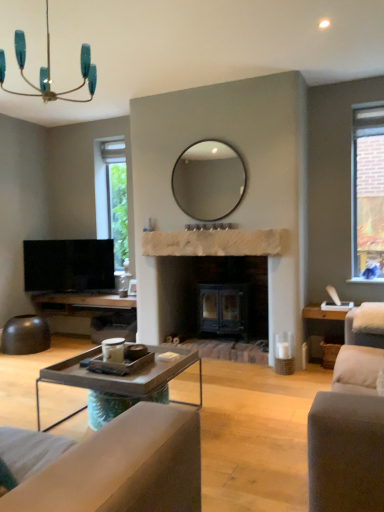
The height and width of the screenshot is (512, 384). Describe the element at coordinates (208, 180) in the screenshot. I see `matte glass mirror at center` at that location.

Image resolution: width=384 pixels, height=512 pixels. I want to click on matte glass mirror at center, so click(x=208, y=180).

From a real-world perspective, which object rests below the other?

In real-world perspective, flat screen tv at left is lower.

From the picture: Is flat screen tv at left aimed at teal glass chandelier at upper left?

No, flat screen tv at left does not turn towards teal glass chandelier at upper left.

Can you tell me how much flat screen tv at left and teal glass chandelier at upper left differ in facing direction?

There is a 21.1-degree angle between the facing directions of flat screen tv at left and teal glass chandelier at upper left.

Considering the sizes of objects matte glass mirror at center and white fabric swivel chair at right in the image provided, who is taller, matte glass mirror at center or white fabric swivel chair at right?

Standing taller between the two is matte glass mirror at center.

Based on the photo, which point is more distant from viewer, [175,174] or [370,341]?

The point [175,174] is more distant.

From a real-world perspective, who is located higher, matte glass mirror at center or white fabric swivel chair at right?

From a 3D spatial view, matte glass mirror at center is above.

Is matte glass mirror at center bigger than flat screen tv at left?

Incorrect, matte glass mirror at center is not larger than flat screen tv at left.

What's the angular difference between matte glass mirror at center and flat screen tv at left's facing directions?

The facing directions of matte glass mirror at center and flat screen tv at left are 23.7 degrees apart.

Which object is thinner, matte glass mirror at center or flat screen tv at left?

matte glass mirror at center.

Image resolution: width=384 pixels, height=512 pixels. What are the coordinates of `mirror above the flat screen tv at left (from a real-world perspective)` in the screenshot? It's located at (208, 180).

Between metallic gray coffee table at lower center and teal glass chandelier at upper left, which one has larger size?

metallic gray coffee table at lower center.

From a real-world perspective, relative to teal glass chandelier at upper left, is metallic gray coffee table at lower center vertically above or below?

In terms of real-world spatial position, metallic gray coffee table at lower center is below teal glass chandelier at upper left.

In the image, is metallic gray coffee table at lower center positioned in front of or behind teal glass chandelier at upper left?

metallic gray coffee table at lower center is behind teal glass chandelier at upper left.

From the image's perspective, is white fabric swivel chair at right located beneath matte glass mirror at center?

Correct, white fabric swivel chair at right appears lower than matte glass mirror at center in the image.

From the picture: Which of these two, white fabric swivel chair at right or matte glass mirror at center, stands taller?

Standing taller between the two is matte glass mirror at center.

Based on their sizes in the image, would you say white fabric swivel chair at right is bigger or smaller than matte glass mirror at center?

In the image, white fabric swivel chair at right appears to be smaller than matte glass mirror at center.

Between metallic gray coffee table at lower center and white fabric swivel chair at right, which one has larger size?

Bigger between the two is metallic gray coffee table at lower center.

In the image, is metallic gray coffee table at lower center on the left side or the right side of white fabric swivel chair at right?

metallic gray coffee table at lower center is to the left of white fabric swivel chair at right.

Locate an element on the screen. The image size is (384, 512). mantle above the flat screen tv at left (from the image's perspective) is located at coordinates (216, 242).

Between flat screen tv at left and natural stone fireplace at center, which one has smaller size?

With smaller size is natural stone fireplace at center.

Between flat screen tv at left and natural stone fireplace at center, which one is positioned behind?

flat screen tv at left is further from the camera.

Is flat screen tv at left positioned with its back to natural stone fireplace at center?

No, flat screen tv at left is not facing away from natural stone fireplace at center.

Identify the location of light fixture in front of the flat screen tv at left. Image resolution: width=384 pixels, height=512 pixels. (49, 70).

The height and width of the screenshot is (512, 384). What are the coordinates of `mirror behind the white fabric swivel chair at right` in the screenshot? It's located at (208, 180).

When comparing their distances from metallic gray coffee table at lower center, does white fabric swivel chair at right or natural stone fireplace at center seem closer?

Based on the image, white fabric swivel chair at right appears to be nearer to metallic gray coffee table at lower center.

Considering their positions, is matte glass mirror at center positioned closer to white fabric swivel chair at right than teal glass chandelier at upper left?

matte glass mirror at center is closer to white fabric swivel chair at right.

From the image, which object appears to be farther from natural stone fireplace at center, white fabric swivel chair at right or metallic gray coffee table at lower center?

Based on the image, metallic gray coffee table at lower center appears to be further to natural stone fireplace at center.

Based on their spatial positions, is white fabric swivel chair at right or teal glass chandelier at upper left closer to natural stone fireplace at center?

The object closer to natural stone fireplace at center is white fabric swivel chair at right.

Based on their spatial positions, is natural stone fireplace at center or white fabric swivel chair at right closer to matte glass mirror at center?

natural stone fireplace at center.

Based on their spatial positions, is matte glass mirror at center or flat screen tv at left closer to teal glass chandelier at upper left?

flat screen tv at left is closer to teal glass chandelier at upper left.

Considering their positions, is white fabric swivel chair at right positioned further to flat screen tv at left than matte glass mirror at center?

white fabric swivel chair at right.

From the image, which object appears to be farther from teal glass chandelier at upper left, natural stone fireplace at center or matte glass mirror at center?

Among the two, matte glass mirror at center is located further to teal glass chandelier at upper left.

Where is `mantle between teal glass chandelier at upper left and flat screen tv at left along the z-axis`? mantle between teal glass chandelier at upper left and flat screen tv at left along the z-axis is located at coordinates (216, 242).

Where is `coffee table between teal glass chandelier at upper left and flat screen tv at left from front to back`? coffee table between teal glass chandelier at upper left and flat screen tv at left from front to back is located at coordinates (122, 376).

This screenshot has height=512, width=384. What are the coordinates of `swivel chair between teal glass chandelier at upper left and matte glass mirror at center along the z-axis` in the screenshot? It's located at (364, 329).

The height and width of the screenshot is (512, 384). Find the location of `mantle between teal glass chandelier at upper left and white fabric swivel chair at right from left to right`. mantle between teal glass chandelier at upper left and white fabric swivel chair at right from left to right is located at coordinates click(216, 242).